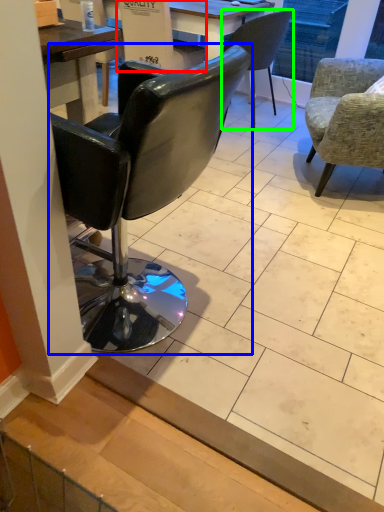
Question: Based on their relative distances, which object is farther from armchair (highlighted by a red box)? Choose from chair (highlighted by a blue box) and chair (highlighted by a green box).

Choices:
 (A) chair
 (B) chair

Answer: (A)